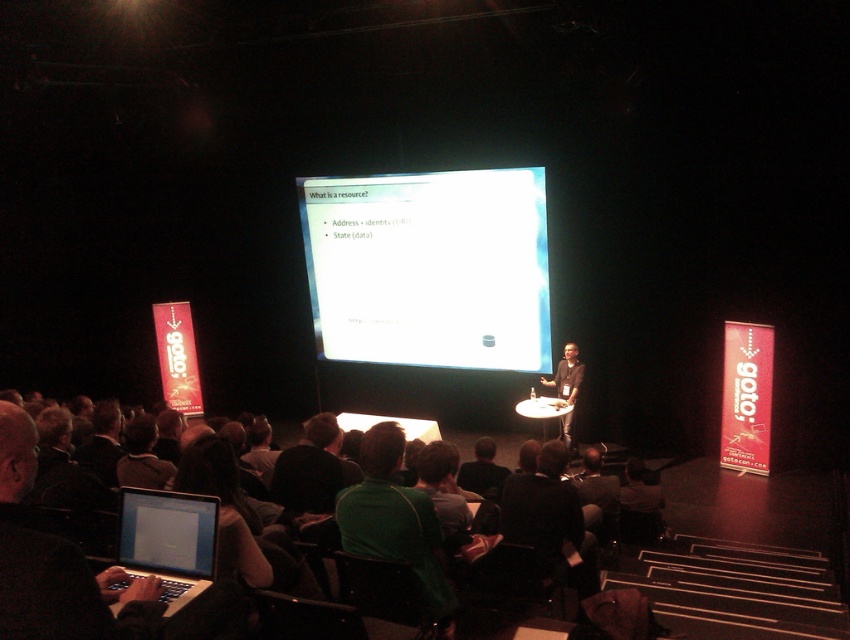
You are sitting in the dark green fabric seats at lower center. If you look straight ahead, which object is directly in front of you?

The large screen displaying a slide titled

You are an attendee at the presentation and you want to borrow a laptop charger from someone sitting near you. You see the black glossy laptop at lower left and the green fabric jacket at lower center. Which object is closer to the stage?

The black glossy laptop at lower left is located above the green fabric jacket at lower center, meaning it is closer to the stage.

Consider the image. You are an attendee at the presentation. You need to quickly jot down notes but your phone is dead. You see the matte black laptop at lower left and the green fabric jacket at center. Which object is closer to your left side so you can reach it faster?

The matte black laptop at lower left is to the left of green fabric jacket at center, so it is closer to your left side and can be reached faster.